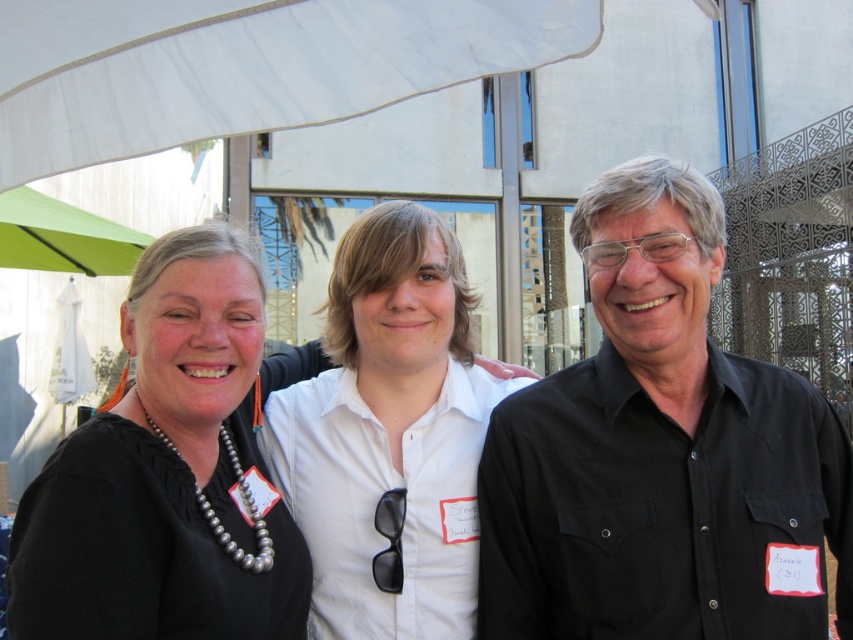
You are at an event under a large white canopy and need to move from the point at coordinates point (242, 490) to the point at coordinates point (143, 74). Which direction should you move to get closer to your destination?

To move from point (242, 490) to point (143, 74), you should move towards the direction of the point at coordinates point (143, 74), as it is in front of the starting point according to the spatial arrangement described.

You are a photographer at this event. You need to capture a photo where the black matte necklace at upper left is visible without being blocked by the white fabric canopy at upper center. Based on their positions, is this possible?

The black matte necklace at upper left is located below the white fabric canopy at upper center, so it is possible to capture the necklace without obstruction as long as the camera angle is adjusted to avoid the canopy.

You are a photographer at a social event under a large white canopy. You need to position yourself to capture a clear shot of the black matte shirt at center. Where should you position yourself relative to the shirt?

The black matte shirt at center is located at coordinates point (660, 452). To capture a clear shot, position yourself directly in front of this point to ensure the shirt is centered in your frame.